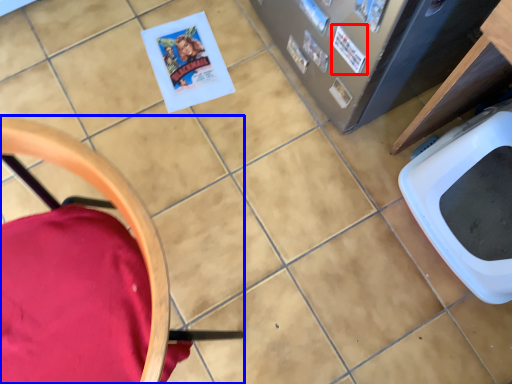
Question: Which object is closer to the camera taking this photo, comic book (highlighted by a red box) or chair (highlighted by a blue box)?

Choices:
 (A) comic book
 (B) chair

Answer: (B)